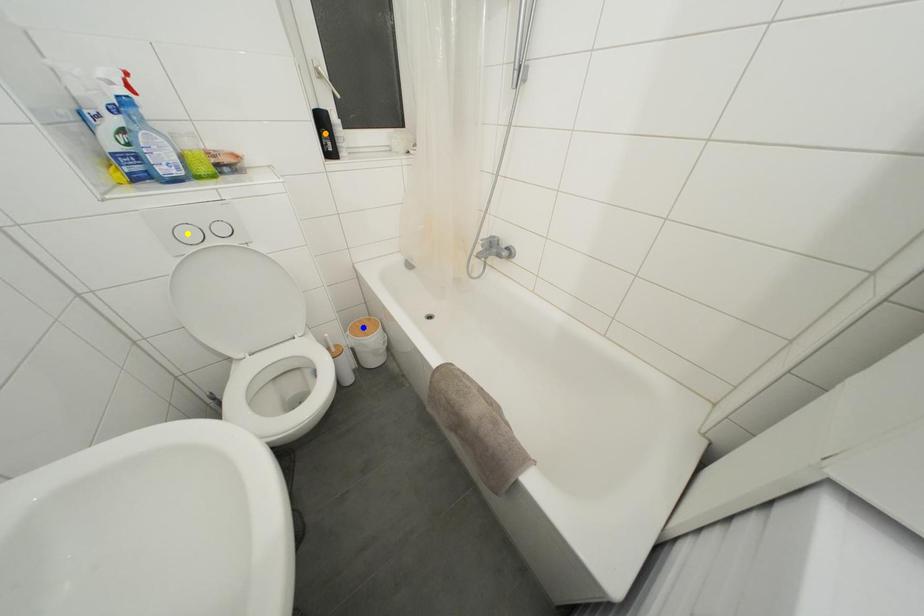
Order these from nearest to farthest:
A) yellow point
B) orange point
C) blue point

yellow point, orange point, blue point